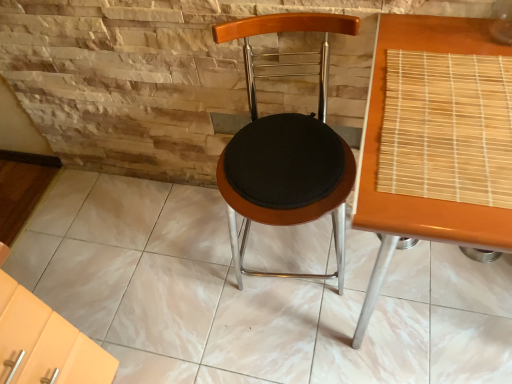
Question: From the image's perspective, is woodenseat cushion at center above or below wooden bamboo mat at right?

Choices:
 (A) below
 (B) above

Answer: (B)

Question: Is woodenseat cushion at center taller or shorter than wooden bamboo mat at right?

Choices:
 (A) short
 (B) tall

Answer: (B)

Question: Estimate the real-world distances between objects in this image. Which object is farther from the wooden bamboo mat at right?

Choices:
 (A) woodenseat cushion at center
 (B) bamboo mat at right

Answer: (A)

Question: Based on their relative distances, which object is nearer to the woodenseat cushion at center?

Choices:
 (A) wooden bamboo mat at right
 (B) bamboo mat at right

Answer: (A)